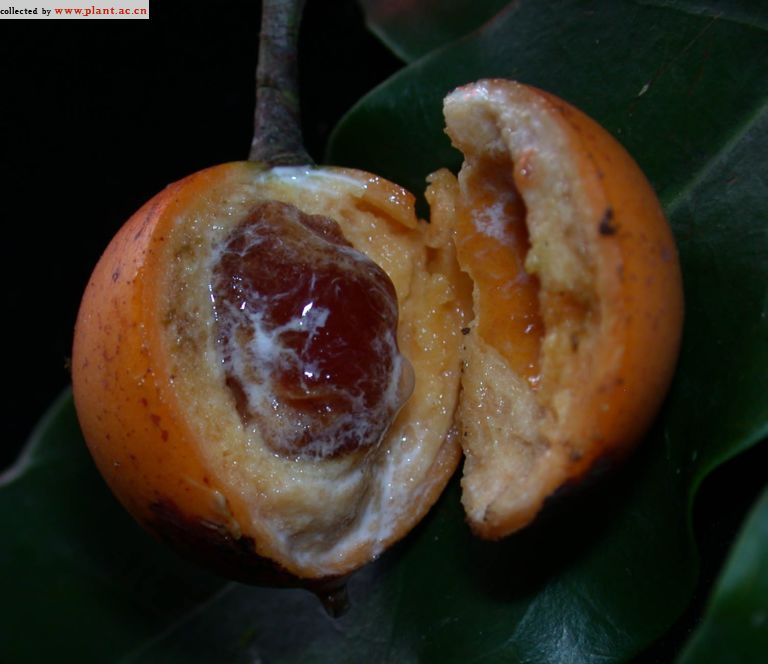
Find the location of a particular element. Image resolution: width=768 pixels, height=664 pixels. casing is located at coordinates (610, 327).